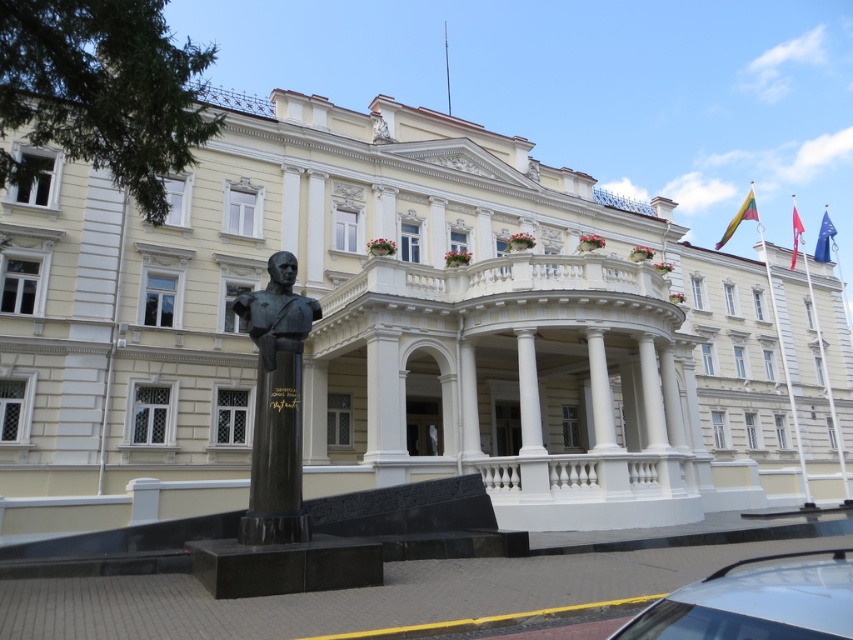
Between point (703, 630) and point (795, 221), which one is positioned in front?

Positioned in front is point (703, 630).

Looking at this image, can you confirm if white glossy car at lower right is positioned above red fabric flag at upper right?

Actually, white glossy car at lower right is below red fabric flag at upper right.

Where is `white glossy car at lower right`? Image resolution: width=853 pixels, height=640 pixels. white glossy car at lower right is located at coordinates (756, 602).

Which is above, black polished stone bust at center or red fabric flag at upper right?

red fabric flag at upper right is above.

Is the position of black polished stone bust at center more distant than that of red fabric flag at upper right?

No, black polished stone bust at center is in front of red fabric flag at upper right.

Locate an element on the screen. The image size is (853, 640). black polished stone bust at center is located at coordinates (276, 404).

This screenshot has height=640, width=853. I want to click on black polished stone bust at center, so coord(276,404).

Is black polished bust at center positioned in front of polished metal flagpole at upper right?

Yes.

Based on the photo, can you confirm if black polished bust at center is positioned above polished metal flagpole at upper right?

Incorrect, black polished bust at center is not positioned above polished metal flagpole at upper right.

Where is `black polished bust at center`? The image size is (853, 640). black polished bust at center is located at coordinates (277, 310).